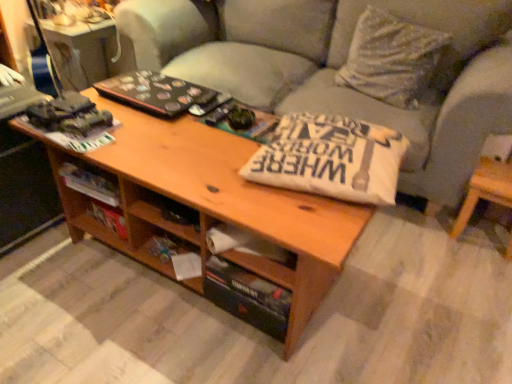
Question: Could you tell me if light gray fabric couch at center is facing light brown wood side table at lower right?

Choices:
 (A) yes
 (B) no

Answer: (B)

Question: From a real-world perspective, does light gray fabric couch at center stand above light brown wood side table at lower right?

Choices:
 (A) yes
 (B) no

Answer: (A)

Question: Considering the relative sizes of light gray fabric couch at center and light brown wood side table at lower right in the image provided, is light gray fabric couch at center smaller than light brown wood side table at lower right?

Choices:
 (A) no
 (B) yes

Answer: (A)

Question: From the image's perspective, is light gray fabric couch at center located beneath light brown wood side table at lower right?

Choices:
 (A) yes
 (B) no

Answer: (B)

Question: Does light gray fabric couch at center come behind light brown wood side table at lower right?

Choices:
 (A) yes
 (B) no

Answer: (B)

Question: Can you confirm if light gray fabric couch at center is shorter than light brown wood side table at lower right?

Choices:
 (A) yes
 (B) no

Answer: (B)

Question: Can you confirm if light gray fabric couch at center is thinner than white textured pillow at upper right?

Choices:
 (A) no
 (B) yes

Answer: (A)

Question: Does light gray fabric couch at center contain white textured pillow at upper right?

Choices:
 (A) no
 (B) yes

Answer: (B)

Question: From a real-world perspective, is light gray fabric couch at center positioned over white textured pillow at upper right based on gravity?

Choices:
 (A) yes
 (B) no

Answer: (B)

Question: Can you confirm if light gray fabric couch at center is wider than white textured pillow at upper right?

Choices:
 (A) yes
 (B) no

Answer: (A)

Question: Considering the relative sizes of light gray fabric couch at center and white textured pillow at upper right in the image provided, is light gray fabric couch at center shorter than white textured pillow at upper right?

Choices:
 (A) no
 (B) yes

Answer: (A)

Question: Is light gray fabric couch at center closer to the viewer compared to white textured pillow at upper right?

Choices:
 (A) yes
 (B) no

Answer: (A)

Question: Is the position of light brown wood side table at lower right less distant than that of wooden drawer at center?

Choices:
 (A) yes
 (B) no

Answer: (B)